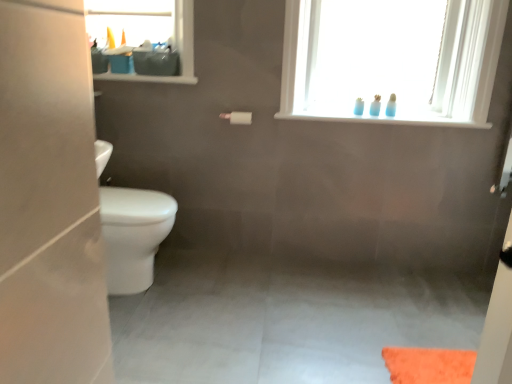
The width and height of the screenshot is (512, 384). Describe the element at coordinates (359, 107) in the screenshot. I see `translucent plastic bottles at upper center, arranged as the first toiletry when viewed from the left` at that location.

Describe the element at coordinates (392, 59) in the screenshot. I see `transparent glass bottles at upper center` at that location.

The height and width of the screenshot is (384, 512). What do you see at coordinates (375, 106) in the screenshot?
I see `blue plastic toothbrushes at upper right, the 2th toiletry in the left-to-right sequence` at bounding box center [375, 106].

The height and width of the screenshot is (384, 512). Identify the location of translucent plastic bottles at upper center, arranged as the first toiletry when viewed from the left. (359, 107).

Does transparent glass bottles at upper center have a smaller size compared to blue translucent toothbrushes at upper right, arranged as the 1th toiletry when viewed from the right?

Actually, transparent glass bottles at upper center might be larger than blue translucent toothbrushes at upper right, arranged as the 1th toiletry when viewed from the right.

The height and width of the screenshot is (384, 512). Identify the location of the 1st toiletry located beneath the transparent glass bottles at upper center (from a real-world perspective). (391, 106).

Is transparent glass bottles at upper center located outside blue translucent toothbrushes at upper right, arranged as the 1th toiletry when viewed from the right?

Indeed, transparent glass bottles at upper center is completely outside blue translucent toothbrushes at upper right, arranged as the 1th toiletry when viewed from the right.

Which is more to the left, transparent glass bottles at upper center or blue translucent toothbrushes at upper right, which is the 3th toiletry in left-to-right order?

From the viewer's perspective, transparent glass bottles at upper center appears more on the left side.

From the image's perspective, is translucent plastic bottles at upper center, which is the 3th toiletry in right-to-left order, on top of transparent glass bottles at upper center?

No, from the image's perspective, translucent plastic bottles at upper center, which is the 3th toiletry in right-to-left order, is not over transparent glass bottles at upper center.

Is translucent plastic bottles at upper center, arranged as the first toiletry when viewed from the left, looking in the opposite direction of transparent glass bottles at upper center?

That's right, translucent plastic bottles at upper center, arranged as the first toiletry when viewed from the left, is facing away from transparent glass bottles at upper center.

Considering the sizes of objects translucent plastic bottles at upper center, arranged as the first toiletry when viewed from the left, and transparent glass bottles at upper center in the image provided, who is taller, translucent plastic bottles at upper center, arranged as the first toiletry when viewed from the left, or transparent glass bottles at upper center?

With more height is transparent glass bottles at upper center.

From a real-world perspective, who is located higher, translucent plastic bottles at upper center, arranged as the first toiletry when viewed from the left, or transparent glass bottles at upper center?

transparent glass bottles at upper center, from a real-world perspective.

From a real-world perspective, who is located lower, white matte toilet paper at center or blue plastic toothbrushes at upper right, the second toiletry from the right?

From a 3D spatial view, white matte toilet paper at center is below.

From the picture: From the image's perspective, which object appears higher, white matte toilet paper at center or blue plastic toothbrushes at upper right, the 2th toiletry in the left-to-right sequence?

blue plastic toothbrushes at upper right, the 2th toiletry in the left-to-right sequence, appears higher in the image.

Looking at this image, are white matte toilet paper at center and blue plastic toothbrushes at upper right, the second toiletry from the right, far apart?

Actually, white matte toilet paper at center and blue plastic toothbrushes at upper right, the second toiletry from the right, are a little close together.

Which is in front, point (234, 122) or point (380, 104)?

The point (380, 104) is more forward.

Considering the relative positions of translucent plastic bottles at upper center, which is the 3th toiletry in right-to-left order, and blue translucent toothbrushes at upper right, which is the 3th toiletry in left-to-right order, in the image provided, is translucent plastic bottles at upper center, which is the 3th toiletry in right-to-left order, to the left or to the right of blue translucent toothbrushes at upper right, which is the 3th toiletry in left-to-right order,?

Clearly, translucent plastic bottles at upper center, which is the 3th toiletry in right-to-left order, is on the left of blue translucent toothbrushes at upper right, which is the 3th toiletry in left-to-right order, in the image.

Considering the sizes of translucent plastic bottles at upper center, which is the 3th toiletry in right-to-left order, and blue translucent toothbrushes at upper right, which is the 3th toiletry in left-to-right order, in the image, is translucent plastic bottles at upper center, which is the 3th toiletry in right-to-left order, bigger or smaller than blue translucent toothbrushes at upper right, which is the 3th toiletry in left-to-right order,?

Considering their sizes, translucent plastic bottles at upper center, which is the 3th toiletry in right-to-left order, takes up less space than blue translucent toothbrushes at upper right, which is the 3th toiletry in left-to-right order.

This screenshot has width=512, height=384. Identify the location of the 2nd toiletry positioned above the translucent plastic bottles at upper center, arranged as the first toiletry when viewed from the left (from the image's perspective). (391, 106).

Could you measure the distance between translucent plastic bottles at upper center, arranged as the first toiletry when viewed from the left, and blue translucent toothbrushes at upper right, which is the 3th toiletry in left-to-right order?

translucent plastic bottles at upper center, arranged as the first toiletry when viewed from the left, and blue translucent toothbrushes at upper right, which is the 3th toiletry in left-to-right order, are 14.71 centimeters apart.

Considering the relative sizes of blue translucent toothbrushes at upper right, arranged as the 1th toiletry when viewed from the right, and translucent plastic bottles at upper center, which is the 3th toiletry in right-to-left order, in the image provided, is blue translucent toothbrushes at upper right, arranged as the 1th toiletry when viewed from the right, thinner than translucent plastic bottles at upper center, which is the 3th toiletry in right-to-left order,?

No, blue translucent toothbrushes at upper right, arranged as the 1th toiletry when viewed from the right, is not thinner than translucent plastic bottles at upper center, which is the 3th toiletry in right-to-left order.

From the image's perspective, is blue translucent toothbrushes at upper right, which is the 3th toiletry in left-to-right order, below translucent plastic bottles at upper center, which is the 3th toiletry in right-to-left order?

Actually, blue translucent toothbrushes at upper right, which is the 3th toiletry in left-to-right order, appears above translucent plastic bottles at upper center, which is the 3th toiletry in right-to-left order, in the image.

Is blue translucent toothbrushes at upper right, which is the 3th toiletry in left-to-right order, not inside translucent plastic bottles at upper center, arranged as the first toiletry when viewed from the left?

That's correct, blue translucent toothbrushes at upper right, which is the 3th toiletry in left-to-right order, is outside of translucent plastic bottles at upper center, arranged as the first toiletry when viewed from the left.

Is blue translucent toothbrushes at upper right, arranged as the 1th toiletry when viewed from the right, far from translucent plastic bottles at upper center, arranged as the first toiletry when viewed from the left?

That's not correct — blue translucent toothbrushes at upper right, arranged as the 1th toiletry when viewed from the right, is a little close to translucent plastic bottles at upper center, arranged as the first toiletry when viewed from the left.

In the image, is translucent plastic bottles at upper center, arranged as the first toiletry when viewed from the left, positioned in front of or behind blue plastic toothbrushes at upper right, the 2th toiletry in the left-to-right sequence?

Clearly, translucent plastic bottles at upper center, arranged as the first toiletry when viewed from the left, is behind blue plastic toothbrushes at upper right, the 2th toiletry in the left-to-right sequence.

From the image's perspective, between translucent plastic bottles at upper center, arranged as the first toiletry when viewed from the left, and blue plastic toothbrushes at upper right, the second toiletry from the right, who is located below?

translucent plastic bottles at upper center, arranged as the first toiletry when viewed from the left.

Who is bigger, translucent plastic bottles at upper center, which is the 3th toiletry in right-to-left order, or blue plastic toothbrushes at upper right, the 2th toiletry in the left-to-right sequence?

translucent plastic bottles at upper center, which is the 3th toiletry in right-to-left order.

Is blue plastic toothbrushes at upper right, the second toiletry from the right, closer to the viewer compared to white matte toilet paper at center?

No, blue plastic toothbrushes at upper right, the second toiletry from the right, is behind white matte toilet paper at center.

How much distance is there between blue plastic toothbrushes at upper right, the second toiletry from the right, and white matte toilet paper at center?

They are 27.13 inches apart.

In terms of height, does blue plastic toothbrushes at upper right, the second toiletry from the right, look taller or shorter compared to white matte toilet paper at center?

Considering their sizes, blue plastic toothbrushes at upper right, the second toiletry from the right, has more height than white matte toilet paper at center.

Where is `toilet paper that appears below the blue plastic toothbrushes at upper right, the second toiletry from the right (from the image's perspective)`? toilet paper that appears below the blue plastic toothbrushes at upper right, the second toiletry from the right (from the image's perspective) is located at coordinates (238, 117).

At what (x,y) coordinates should I click in order to perform the action: click on the 1st toiletry behind the transparent glass bottles at upper center, counting from the anchor's position. Please return your answer as a coordinate pair (x, y). Looking at the image, I should click on (391, 106).

Identify the location of toiletry that is on the left side of transparent glass bottles at upper center. (359, 107).

Which object lies nearer to the anchor point blue translucent toothbrushes at upper right, arranged as the 1th toiletry when viewed from the right, transparent glass bottles at upper center or white matte toilet paper at center?

The object closer to blue translucent toothbrushes at upper right, arranged as the 1th toiletry when viewed from the right, is transparent glass bottles at upper center.

Considering their positions, is translucent plastic bottles at upper center, arranged as the first toiletry when viewed from the left, positioned closer to transparent glass bottles at upper center than white matte toilet paper at center?

Based on the image, translucent plastic bottles at upper center, arranged as the first toiletry when viewed from the left, appears to be nearer to transparent glass bottles at upper center.

Which object lies further to the anchor point translucent plastic bottles at upper center, arranged as the first toiletry when viewed from the left, white matte toilet paper at center or transparent glass bottles at upper center?

white matte toilet paper at center lies further to translucent plastic bottles at upper center, arranged as the first toiletry when viewed from the left, than the other object.

Which object lies further to the anchor point transparent glass bottles at upper center, blue translucent toothbrushes at upper right, arranged as the 1th toiletry when viewed from the right, or translucent plastic bottles at upper center, which is the 3th toiletry in right-to-left order?

Among the two, translucent plastic bottles at upper center, which is the 3th toiletry in right-to-left order, is located further to transparent glass bottles at upper center.

From the image, which object appears to be farther from translucent plastic bottles at upper center, which is the 3th toiletry in right-to-left order, blue plastic toothbrushes at upper right, the 2th toiletry in the left-to-right sequence, or white matte toilet paper at center?

Based on the image, white matte toilet paper at center appears to be further to translucent plastic bottles at upper center, which is the 3th toiletry in right-to-left order.

Based on their spatial positions, is white matte toilet paper at center or blue plastic toothbrushes at upper right, the second toiletry from the right, further from blue translucent toothbrushes at upper right, arranged as the 1th toiletry when viewed from the right?

Among the two, white matte toilet paper at center is located further to blue translucent toothbrushes at upper right, arranged as the 1th toiletry when viewed from the right.

Looking at the image, which one is located further to white matte toilet paper at center, blue translucent toothbrushes at upper right, which is the 3th toiletry in left-to-right order, or blue plastic toothbrushes at upper right, the second toiletry from the right?

Among the two, blue translucent toothbrushes at upper right, which is the 3th toiletry in left-to-right order, is located further to white matte toilet paper at center.

Estimate the real-world distances between objects in this image. Which object is further from translucent plastic bottles at upper center, which is the 3th toiletry in right-to-left order, transparent glass bottles at upper center or blue translucent toothbrushes at upper right, arranged as the 1th toiletry when viewed from the right?

The object further to translucent plastic bottles at upper center, which is the 3th toiletry in right-to-left order, is transparent glass bottles at upper center.

The image size is (512, 384). In order to click on toiletry between white matte toilet paper at center and blue plastic toothbrushes at upper right, the 2th toiletry in the left-to-right sequence, in the horizontal direction in this screenshot , I will do `click(359, 107)`.

Identify the location of window located between white matte toilet paper at center and blue translucent toothbrushes at upper right, arranged as the 1th toiletry when viewed from the right, in the left-right direction. tap(392, 59).

Locate an element on the screen. toiletry situated between translucent plastic bottles at upper center, which is the 3th toiletry in right-to-left order, and blue translucent toothbrushes at upper right, which is the 3th toiletry in left-to-right order, from left to right is located at coordinates (375, 106).

At what (x,y) coordinates should I click in order to perform the action: click on toiletry between transparent glass bottles at upper center and blue plastic toothbrushes at upper right, the second toiletry from the right, from top to bottom. Please return your answer as a coordinate pair (x, y). Looking at the image, I should click on coord(391,106).